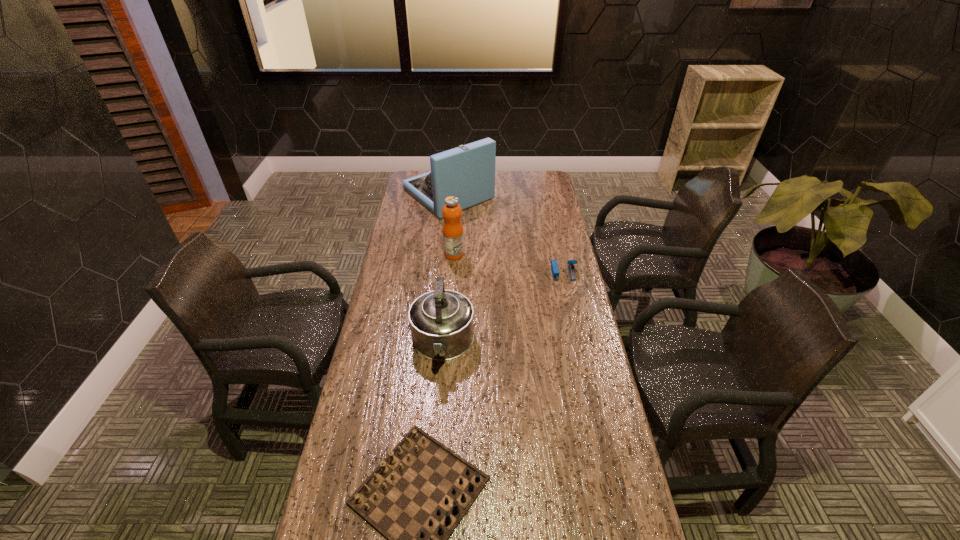
The image size is (960, 540). I want to click on blank region between the third nearest object and the farthest object, so click(x=506, y=233).

This screenshot has width=960, height=540. I want to click on blank region between the farthest object and the fourth farthest object, so click(x=445, y=269).

Select which object appears as the closest to the fourth nearest object. Please provide its 2D coordinates. Your answer should be formatted as a tuple, i.e. [(x, y)], where the tuple contains the x and y coordinates of a point satisfying the conditions above.

[(467, 172)]

At what (x,y) coordinates should I click in order to perform the action: click on the second closest object to the phonograph record. Please return your answer as a coordinate pair (x, y). Looking at the image, I should click on (554, 266).